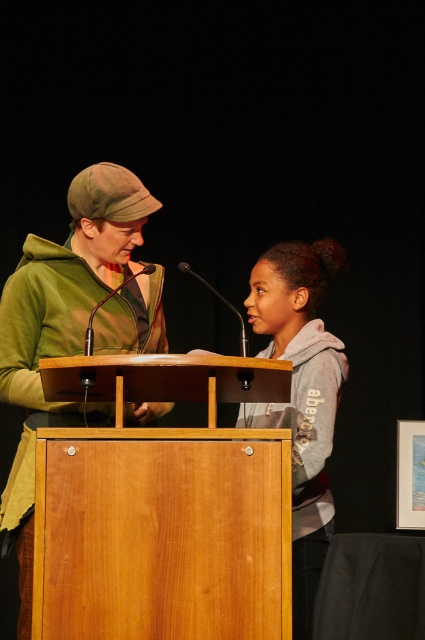
Is wooden podium at center positioned before green matte jacket at center?

Yes, wooden podium at center is in front of green matte jacket at center.

Who is lower down, wooden podium at center or green matte jacket at center?

Positioned lower is wooden podium at center.

The height and width of the screenshot is (640, 425). What are the coordinates of `wooden podium at center` in the screenshot? It's located at (163, 509).

Where is `wooden podium at center`? This screenshot has width=425, height=640. wooden podium at center is located at coordinates (163, 509).

In the scene shown: Is wooden podium at center to the left of gray fleece hoodie at center from the viewer's perspective?

Correct, you'll find wooden podium at center to the left of gray fleece hoodie at center.

Is point (278, 529) positioned behind point (311, 300)?

That is False.

Between point (44, 472) and point (303, 548), which one is positioned in front?

Point (44, 472)

The width and height of the screenshot is (425, 640). In order to click on wooden podium at center in this screenshot , I will do `click(163, 509)`.

Does green matte jacket at center appear under gray fleece hoodie at center?

No.

Between point (138, 292) and point (299, 380), which one is positioned in front?

Point (138, 292) is in front.

I want to click on green matte jacket at center, so click(71, 324).